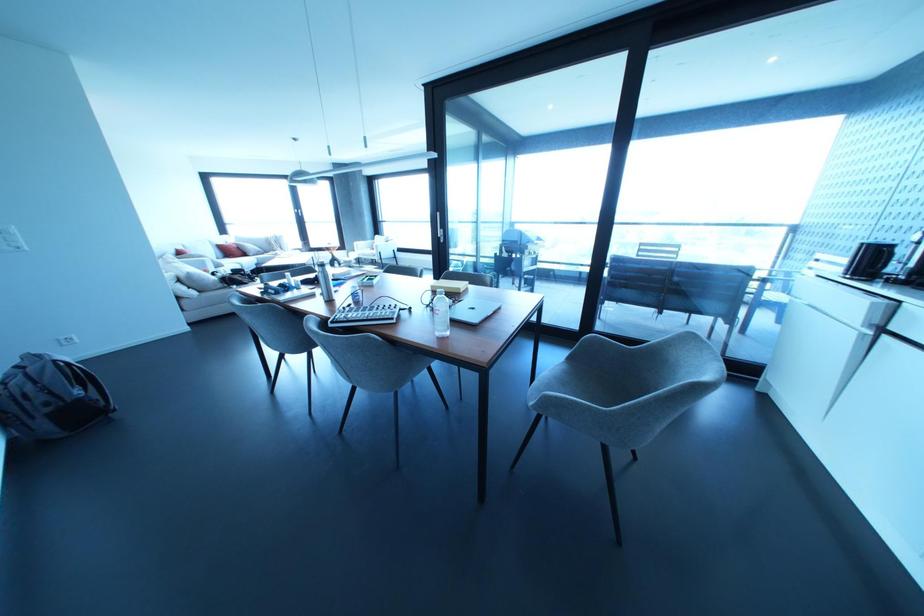
Describe the element at coordinates (10, 238) in the screenshot. I see `a white light switch` at that location.